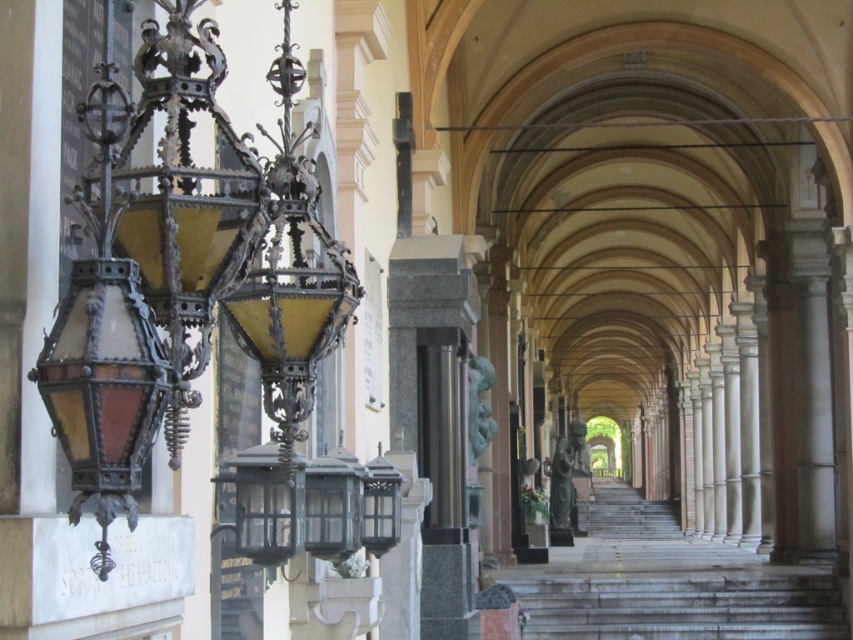
Does white marble stairs at lower center have a lesser height compared to bronze statue at center?

Yes.

Looking at this image, between white marble stairs at lower center and bronze statue at center, which one appears on the right side from the viewer's perspective?

white marble stairs at lower center is more to the right.

Locate an element on the screen. white marble stairs at lower center is located at coordinates (679, 604).

The height and width of the screenshot is (640, 853). Find the location of `white marble stairs at lower center`. white marble stairs at lower center is located at coordinates (679, 604).